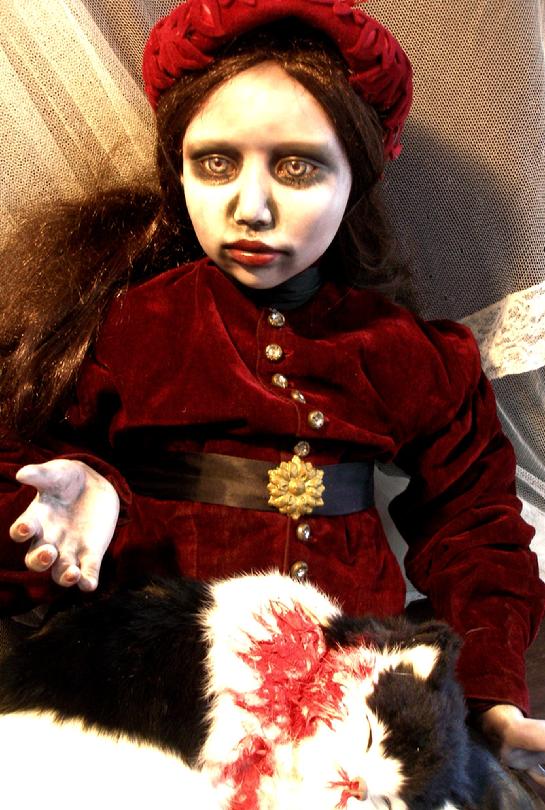
Find the location of a particular element. Image resolution: width=545 pixels, height=810 pixels. doll is located at coordinates (254, 188).